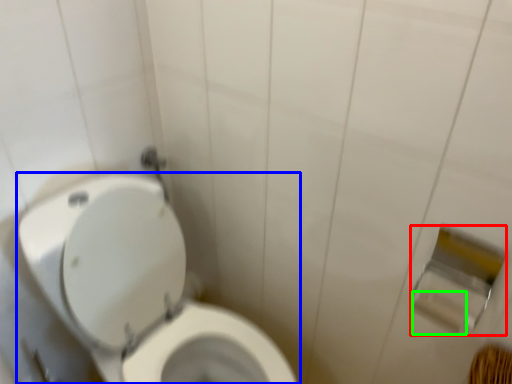
Question: Considering the real-world distances, which object is farthest from toilet paper (highlighted by a red box)? toilet (highlighted by a blue box) or toilet paper (highlighted by a green box)?

Choices:
 (A) toilet
 (B) toilet paper

Answer: (A)